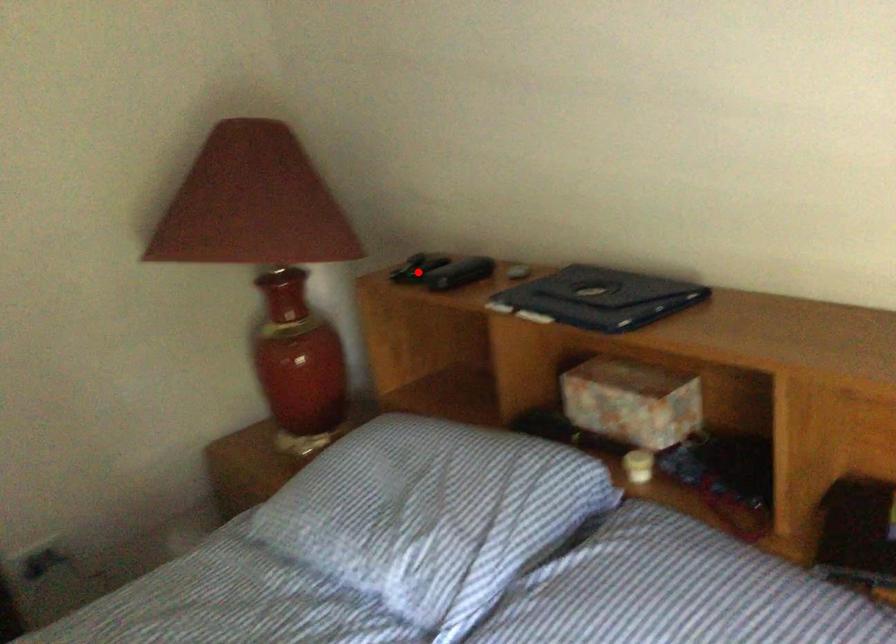
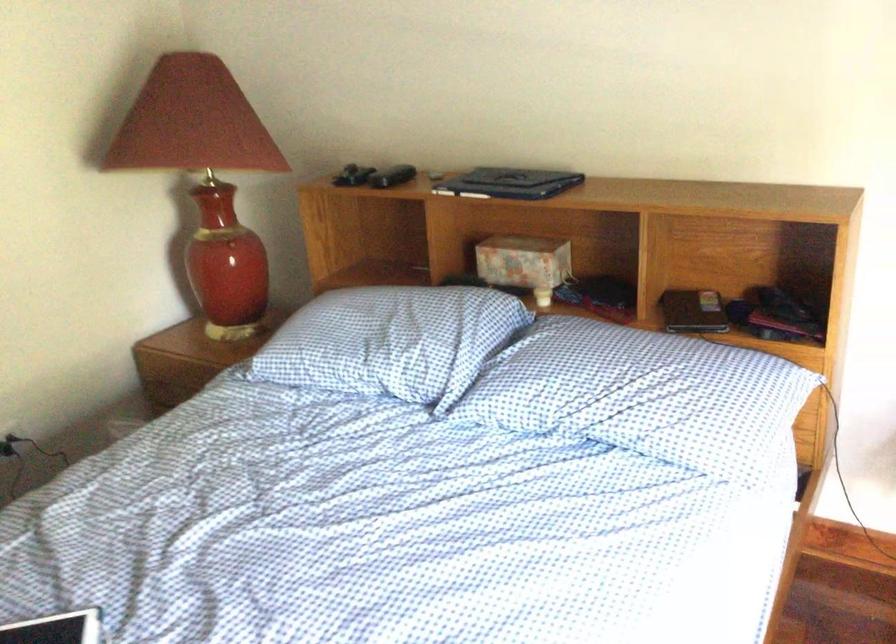
Question: I am providing you with two images of the same scene from different viewpoints. Given a red point in image1, look at the same physical point in image2. Is it:

Choices:
 (A) Closer to the viewpoint
 (B) Farther from the viewpoint

Answer: (B)